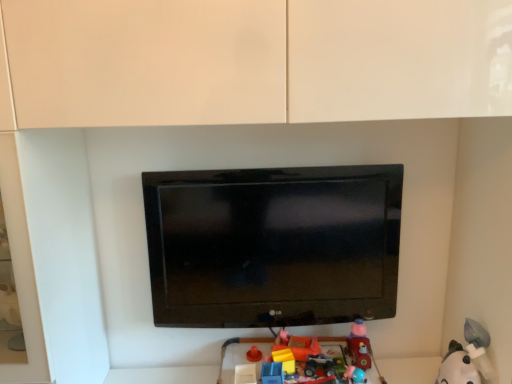
Question: Would you say blue plastic toy at lower center, acting as the first toy starting from the left, is outside white plush toy at lower right, placed as the 4th toy when sorted from left to right?

Choices:
 (A) no
 (B) yes

Answer: (B)

Question: Could you tell me if blue plastic toy at lower center, marked as the 4th toy in a right-to-left arrangement, is facing white plush toy at lower right, which is the first toy from right to left?

Choices:
 (A) no
 (B) yes

Answer: (A)

Question: Is blue plastic toy at lower center, acting as the first toy starting from the left, touching white plush toy at lower right, which is the first toy from right to left?

Choices:
 (A) yes
 (B) no

Answer: (B)

Question: Is blue plastic toy at lower center, marked as the 4th toy in a right-to-left arrangement, smaller than white plush toy at lower right, which is the first toy from right to left?

Choices:
 (A) no
 (B) yes

Answer: (B)

Question: Is there a large distance between blue plastic toy at lower center, marked as the 4th toy in a right-to-left arrangement, and white plush toy at lower right, which is the first toy from right to left?

Choices:
 (A) no
 (B) yes

Answer: (A)

Question: Is matte plastic toy car at lower right, the 3th toy positioned from the left, wider or thinner than blue plastic toy at lower center, acting as the first toy starting from the left?

Choices:
 (A) wide
 (B) thin

Answer: (A)

Question: In the image, is matte plastic toy car at lower right, the 3th toy positioned from the left, positioned in front of or behind blue plastic toy at lower center, marked as the 4th toy in a right-to-left arrangement?

Choices:
 (A) behind
 (B) front

Answer: (A)

Question: From the image's perspective, relative to blue plastic toy at lower center, marked as the 4th toy in a right-to-left arrangement, is matte plastic toy car at lower right, positioned as the 2th toy in right-to-left order, above or below?

Choices:
 (A) below
 (B) above

Answer: (B)

Question: From a real-world perspective, relative to blue plastic toy at lower center, acting as the first toy starting from the left, is matte plastic toy car at lower right, the 3th toy positioned from the left, vertically above or below?

Choices:
 (A) above
 (B) below

Answer: (A)

Question: Is white plush toy at lower right, which is the first toy from right to left, inside the boundaries of matte plastic toy car at lower right, the 3th toy positioned from the left, or outside?

Choices:
 (A) inside
 (B) outside

Answer: (B)

Question: In terms of width, does white plush toy at lower right, placed as the 4th toy when sorted from left to right, look wider or thinner when compared to matte plastic toy car at lower right, the 3th toy positioned from the left?

Choices:
 (A) wide
 (B) thin

Answer: (A)

Question: Considering the positions of point (452, 380) and point (356, 339), is point (452, 380) closer or farther from the camera than point (356, 339)?

Choices:
 (A) farther
 (B) closer

Answer: (B)

Question: From a real-world perspective, is white plush toy at lower right, placed as the 4th toy when sorted from left to right, positioned above or below matte plastic toy car at lower right, the 3th toy positioned from the left?

Choices:
 (A) above
 (B) below

Answer: (B)

Question: Is white plush toy at lower right, placed as the 4th toy when sorted from left to right, inside or outside of blue plastic toy at lower center, acting as the first toy starting from the left?

Choices:
 (A) outside
 (B) inside

Answer: (A)

Question: Is white plush toy at lower right, placed as the 4th toy when sorted from left to right, wider or thinner than blue plastic toy at lower center, marked as the 4th toy in a right-to-left arrangement?

Choices:
 (A) thin
 (B) wide

Answer: (B)